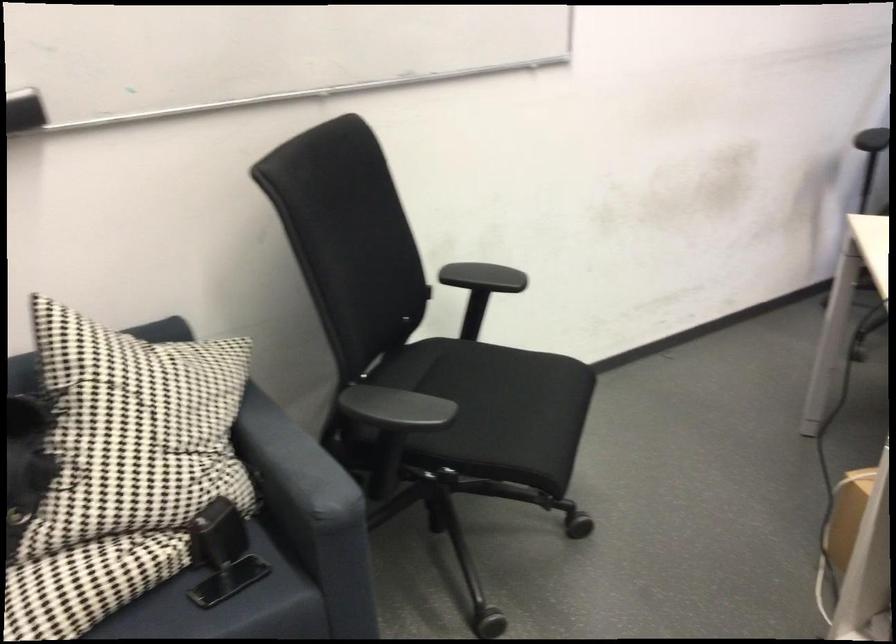
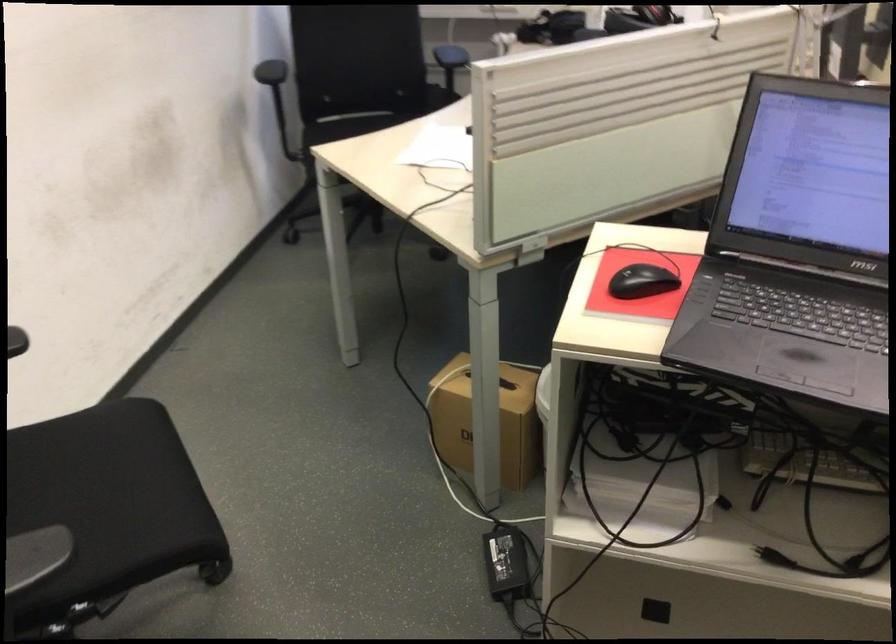
Question: The camera is either moving clockwise (left) or counter-clockwise (right) around the object. The first image is from the beginning of the video and the second image is from the end. Is the camera moving left or right when shooting the video?

Choices:
 (A) Left
 (B) Right

Answer: (A)